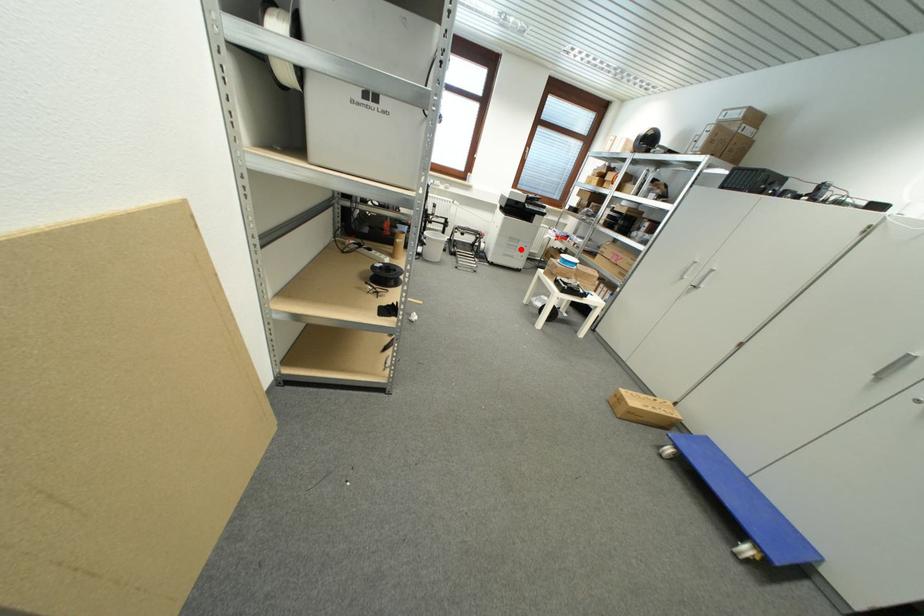
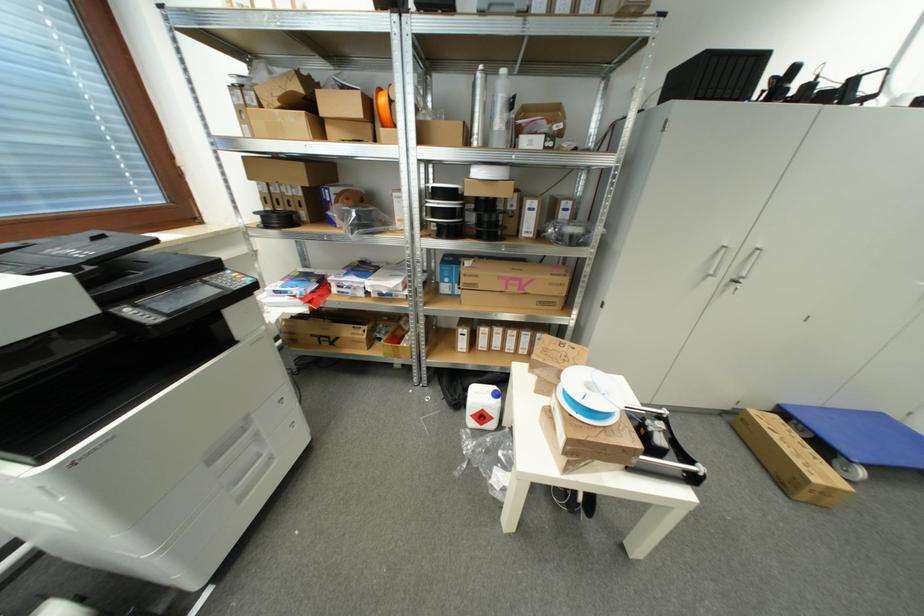
Question: I am providing you with two images of the same scene from different viewpoints. Given a red point in image1, look at the same physical point in image2. Is it:

Choices:
 (A) Closer to the viewpoint
 (B) Farther from the viewpoint

Answer: (B)